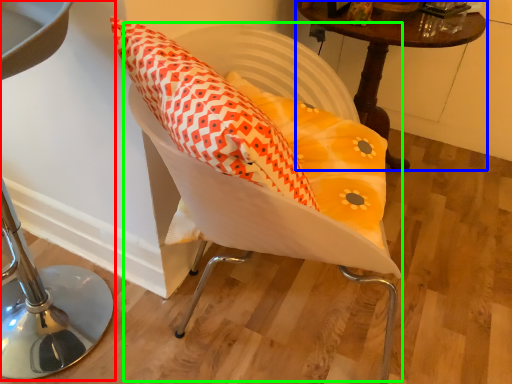
Question: Estimate the real-world distances between objects in this image. Which object is farther from furniture (highlighted by a red box), table (highlighted by a blue box) or swivel chair (highlighted by a green box)?

Choices:
 (A) table
 (B) swivel chair

Answer: (A)